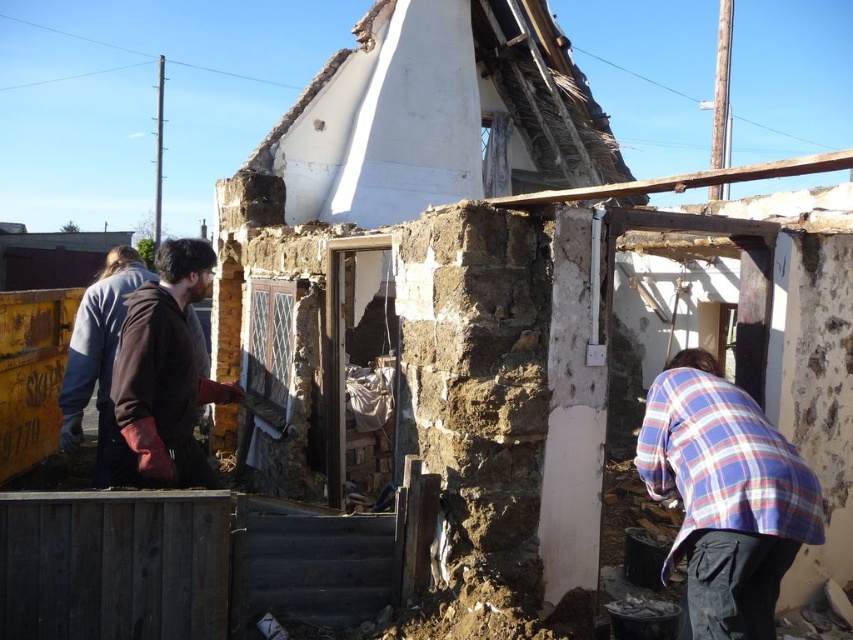
Is plaid fabric shirt at lower right to the right of dark blue jacket at left from the viewer's perspective?

Correct, you'll find plaid fabric shirt at lower right to the right of dark blue jacket at left.

You are a GUI agent. You are given a task and a screenshot of the screen. Output one action in this format:
    pyautogui.click(x=<x>, y=<y>)
    Task: Click on the plaid fabric shirt at lower right
    The height and width of the screenshot is (640, 853).
    Given the screenshot: What is the action you would take?
    pyautogui.click(x=724, y=496)

Between point (764, 598) and point (113, 378), which one is positioned behind?

Point (113, 378)

Does plaid fabric shirt at lower right appear over brown leather jacket at left?

No, plaid fabric shirt at lower right is not above brown leather jacket at left.

Who is more forward, (746, 472) or (160, 317)?

Point (746, 472) is more forward.

This screenshot has height=640, width=853. Find the location of `plaid fabric shirt at lower right`. plaid fabric shirt at lower right is located at coordinates tap(724, 496).

Does brown leather jacket at left have a greater height compared to dark blue jacket at left?

Yes.

Can you confirm if brown leather jacket at left is positioned to the right of dark blue jacket at left?

Yes, brown leather jacket at left is to the right of dark blue jacket at left.

Is point (210, 260) less distant than point (97, 312)?

Yes, it is in front of point (97, 312).

Where is `brown leather jacket at left`? brown leather jacket at left is located at coordinates (161, 376).